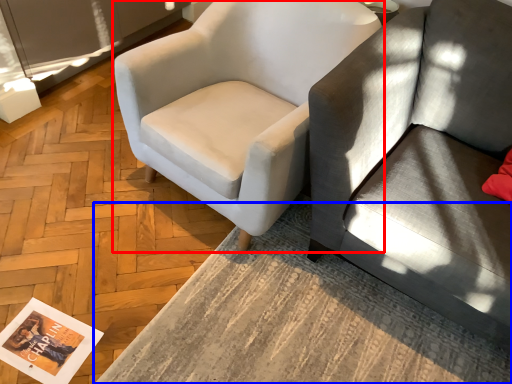
Question: Which object appears closest to the camera in this image, chair (highlighted by a red box) or table (highlighted by a blue box)?

Choices:
 (A) chair
 (B) table

Answer: (B)